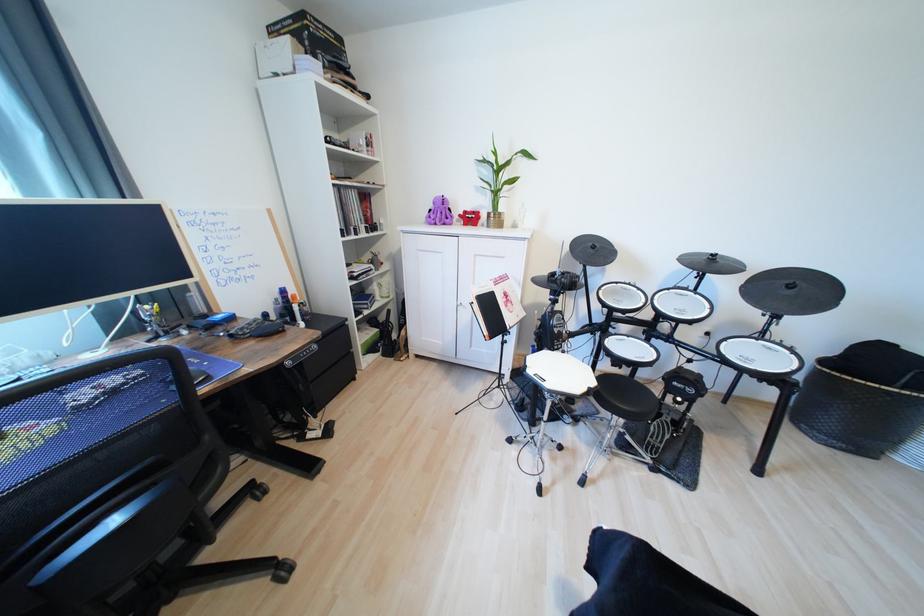
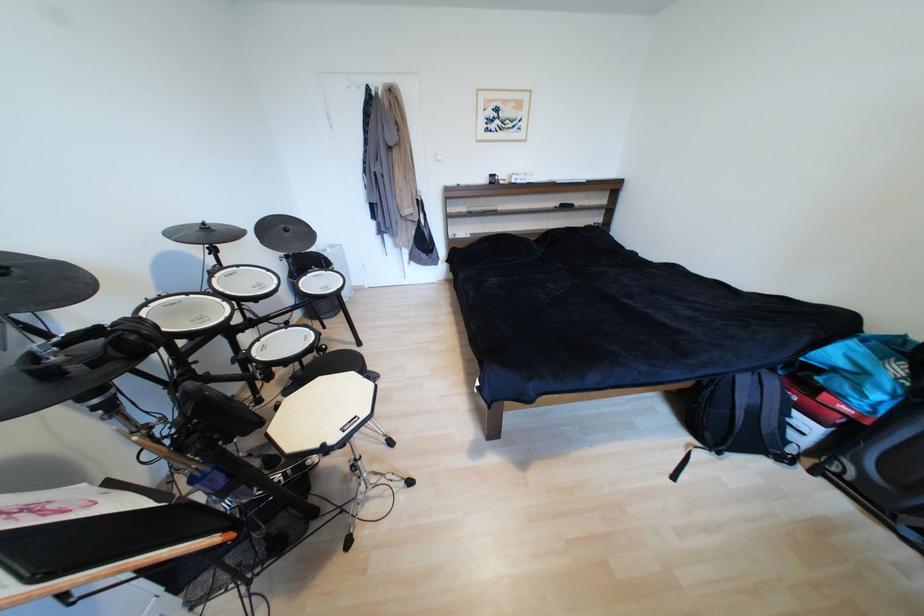
Based on the continuous images, in which direction is the camera rotating?

The camera rotated toward right-down.